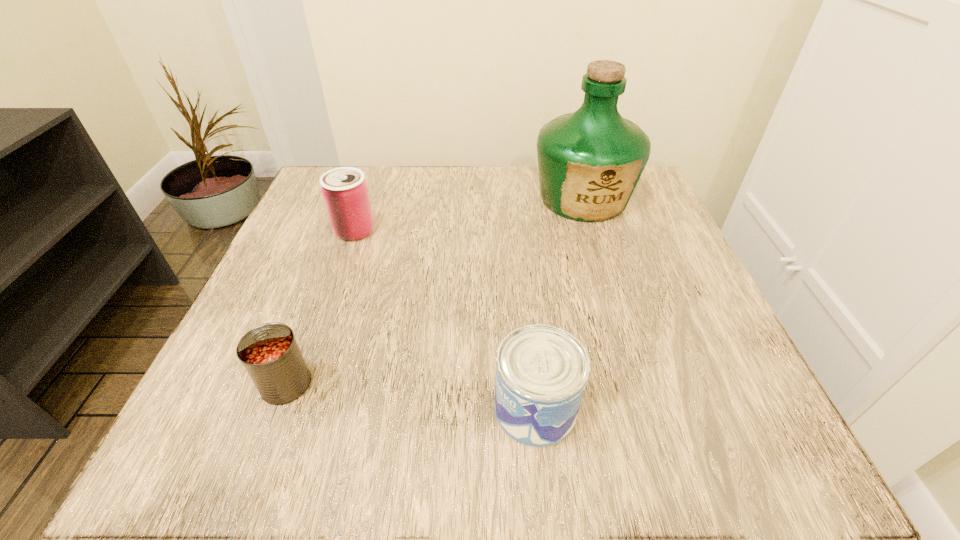
You are a GUI agent. You are given a task and a screenshot of the screen. Output one action in this format:
    pyautogui.click(x=<x>, y=<y>)
    Task: Click on the tallest object
    
    Given the screenshot: What is the action you would take?
    pyautogui.click(x=590, y=161)

Where is `the farthest can`? The height and width of the screenshot is (540, 960). the farthest can is located at coordinates (345, 192).

Where is `the rightmost can`? The height and width of the screenshot is (540, 960). the rightmost can is located at coordinates (541, 371).

Locate an element on the screen. free location located 0.230m on the label side of the tallest object is located at coordinates pyautogui.click(x=617, y=310).

Identify the location of vacant space positioned 0.160m on the front of the farthest can. This screenshot has height=540, width=960. (330, 301).

The image size is (960, 540). I want to click on vacant space located on the front label of the rightmost can, so click(x=301, y=409).

Identify the location of free space located on the front label of the rightmost can. This screenshot has height=540, width=960. (323, 409).

Image resolution: width=960 pixels, height=540 pixels. Identify the location of vacant point located on the front label of the rightmost can. (366, 409).

I want to click on liquor that is positioned at the far edge, so click(x=590, y=161).

Where is `can at the far edge`? The image size is (960, 540). can at the far edge is located at coordinates (345, 192).